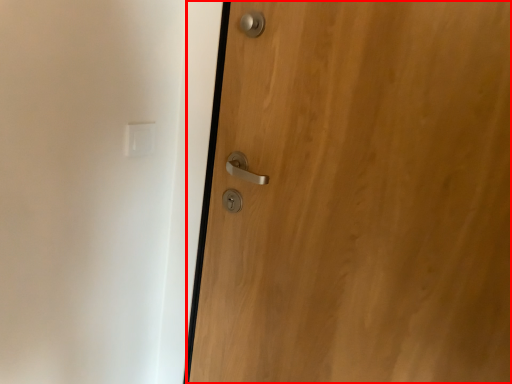
Question: Considering the relative positions of door (annotated by the red box) and light switch in the image provided, where is door (annotated by the red box) located with respect to the staircase?

Choices:
 (A) right
 (B) left

Answer: (A)